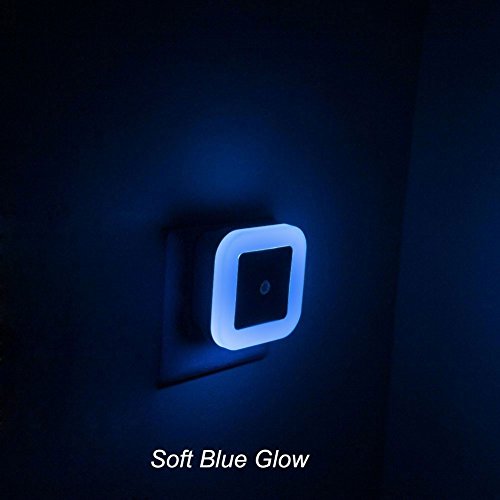
I want to click on corner, so click(395, 272).